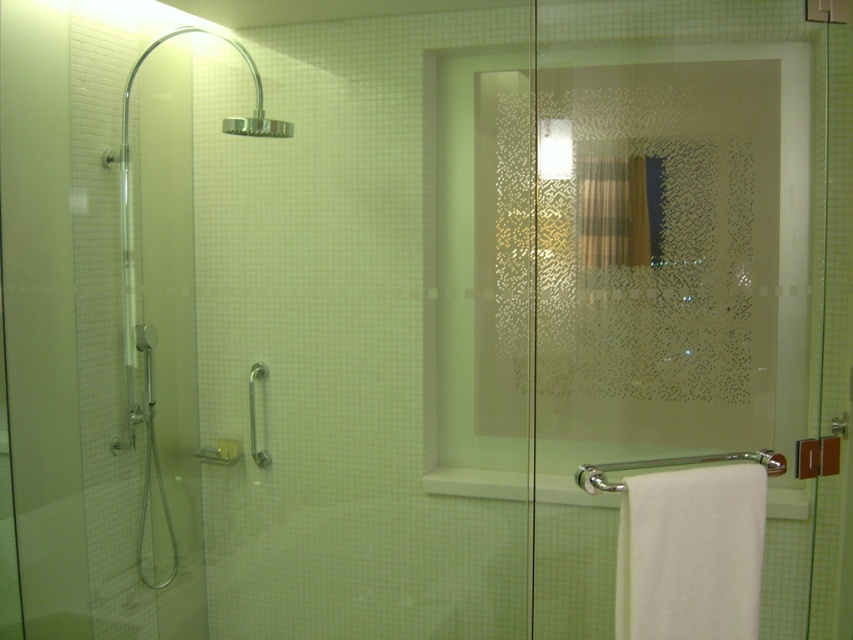
Question: Which object is positioned farthest from the silver metallic grab bar at lower left?

Choices:
 (A) transparent glass shower door at left
 (B) polished chrome towel bar at lower right

Answer: (B)

Question: Which of the following is the closest to the observer?

Choices:
 (A) (608, 468)
 (B) (73, 429)

Answer: (A)

Question: Does transparent glass shower door at left have a smaller size compared to polished chrome towel bar at lower right?

Choices:
 (A) yes
 (B) no

Answer: (B)

Question: Is the position of polished chrome towel bar at lower right more distant than that of silver metallic grab bar at lower left?

Choices:
 (A) yes
 (B) no

Answer: (B)

Question: Can you confirm if transparent glass shower door at left is bigger than silver metallic grab bar at lower left?

Choices:
 (A) yes
 (B) no

Answer: (A)

Question: Which is nearer to the silver metallic grab bar at lower left?

Choices:
 (A) transparent glass shower door at left
 (B) polished chrome towel bar at lower right

Answer: (A)